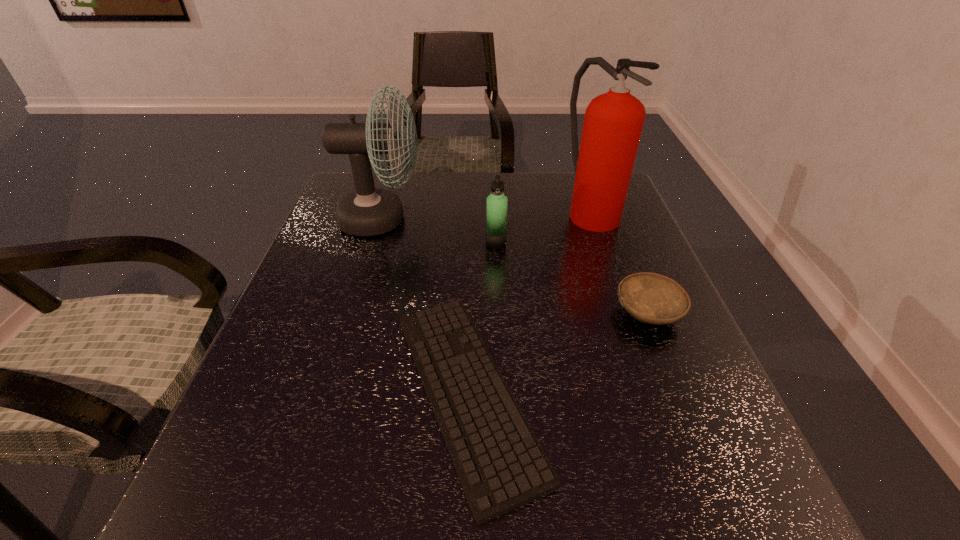
Locate an element on the screen. The image size is (960, 540). free region at the right edge is located at coordinates 635,380.

Image resolution: width=960 pixels, height=540 pixels. I want to click on vacant space at the near left corner of the desktop, so [x=258, y=501].

I want to click on vacant space at the near right corner of the desktop, so click(762, 530).

Locate an element on the screen. The height and width of the screenshot is (540, 960). free spot between the shortest object and the tallest object is located at coordinates (529, 301).

At what (x,y) coordinates should I click in order to perform the action: click on unoccupied position between the fan and the shortest object. Please return your answer as a coordinate pair (x, y). The image size is (960, 540). Looking at the image, I should click on (424, 306).

Where is `vacant area between the computer keyboard and the tallest object`? This screenshot has width=960, height=540. vacant area between the computer keyboard and the tallest object is located at coordinates (529, 301).

The height and width of the screenshot is (540, 960). Identify the location of free area in between the fire extinguisher and the computer keyboard. (529, 301).

What are the coordinates of `vacant space that is in between the second tallest object and the fourth tallest object` in the screenshot? It's located at (515, 266).

Where is `blank region between the computer keyboard and the second tallest object`? The height and width of the screenshot is (540, 960). blank region between the computer keyboard and the second tallest object is located at coordinates pyautogui.click(x=424, y=306).

At what (x,y) coordinates should I click in order to perform the action: click on unoccupied position between the shortest object and the tallest object. Please return your answer as a coordinate pair (x, y). The height and width of the screenshot is (540, 960). Looking at the image, I should click on (529, 301).